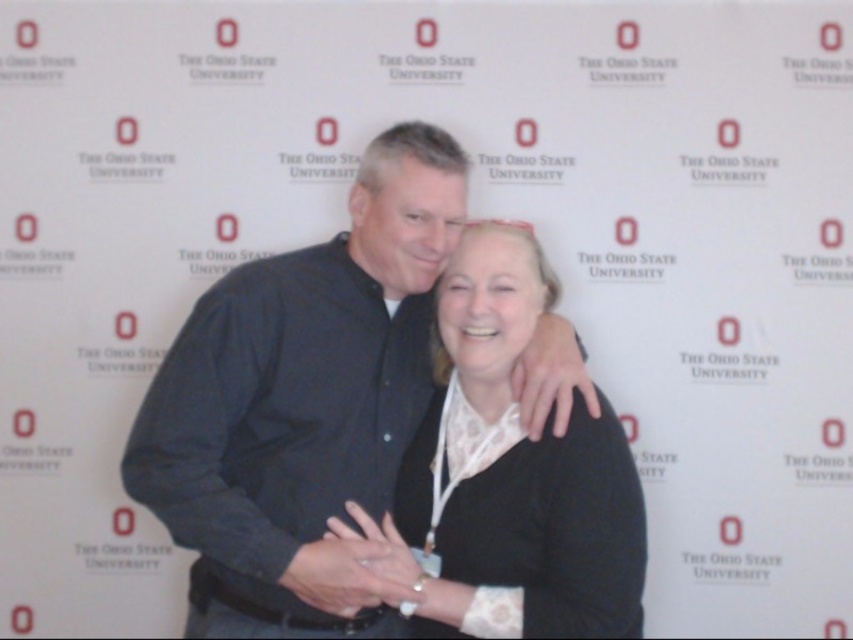
Who is shorter, black matte shirt at center or black matte sweater at center?

Standing shorter between the two is black matte sweater at center.

Between black matte shirt at center and black matte sweater at center, which one appears on the left side from the viewer's perspective?

black matte shirt at center is more to the left.

This screenshot has height=640, width=853. What do you see at coordinates (302, 404) in the screenshot? I see `black matte shirt at center` at bounding box center [302, 404].

Identify the location of black matte shirt at center. (302, 404).